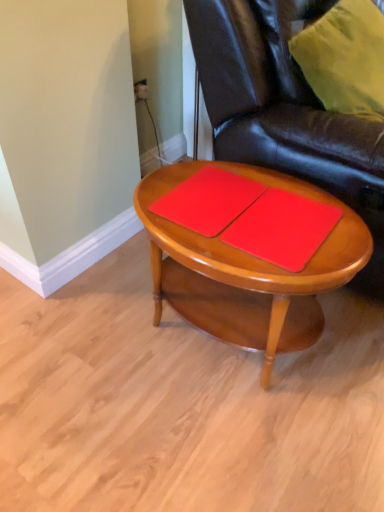
Find the location of a particular element. The image size is (384, 512). vacant region in front of matte wood coffee table at center is located at coordinates (218, 444).